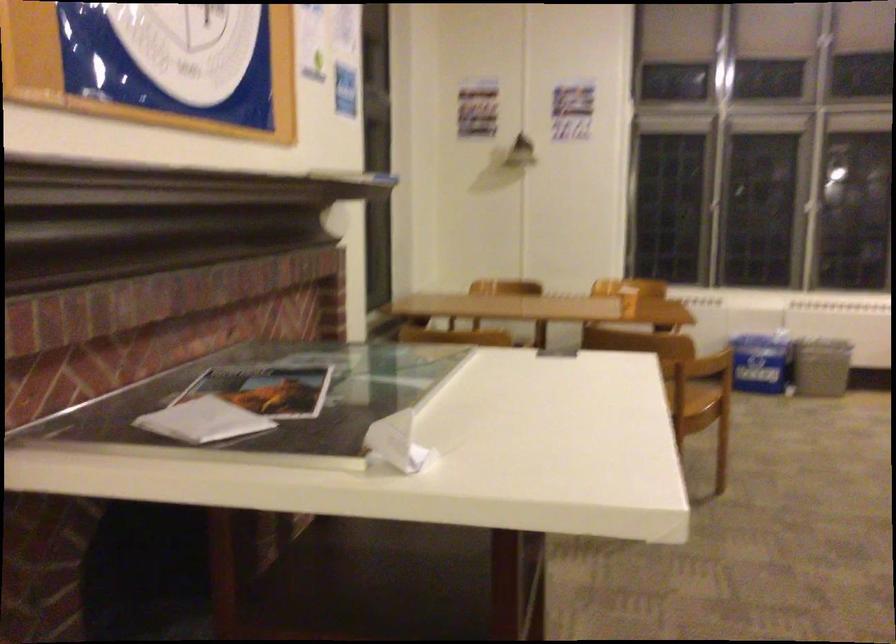
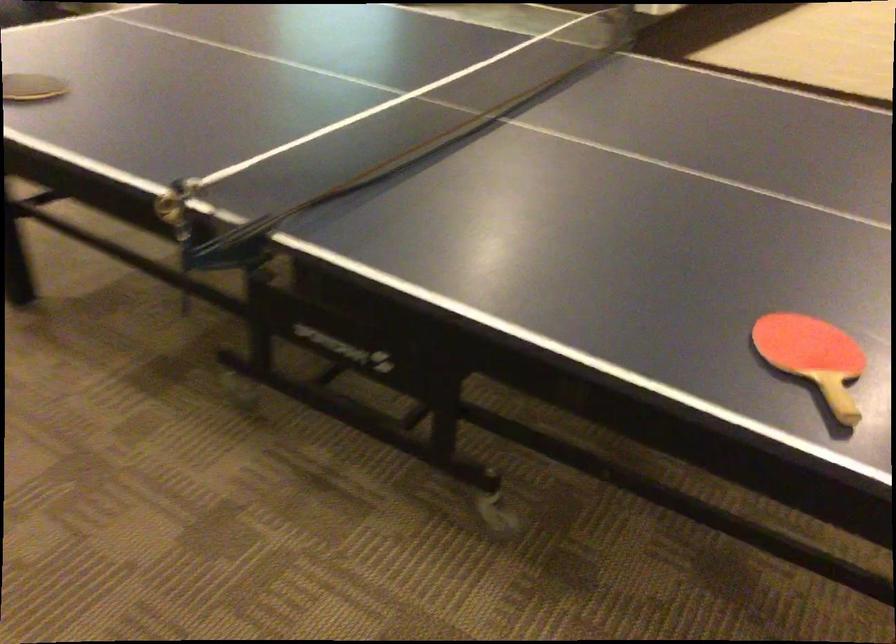
First-person continuous shooting, in which direction is the camera rotating?

The rotation direction of the camera is right-down.